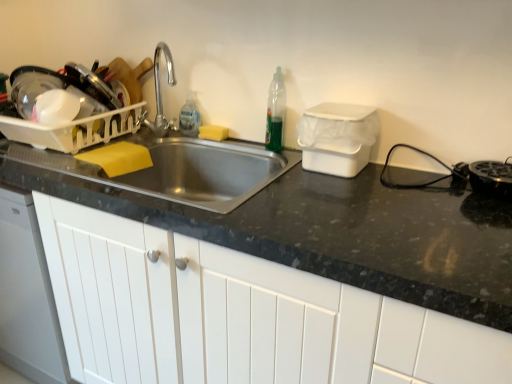
Locate an element on the screen. empty space that is in between black plastic toaster at right, the 1th appliance from the right, and white plastic container at upper right, arranged as the second appliance when viewed from the left is located at coordinates (414, 183).